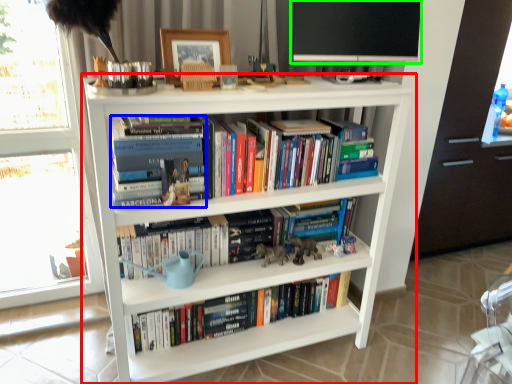
Question: Based on their relative distances, which object is farther from shelf (highlighted by a red box)? Choose from book (highlighted by a blue box) and computer monitor (highlighted by a green box).

Choices:
 (A) book
 (B) computer monitor

Answer: (B)